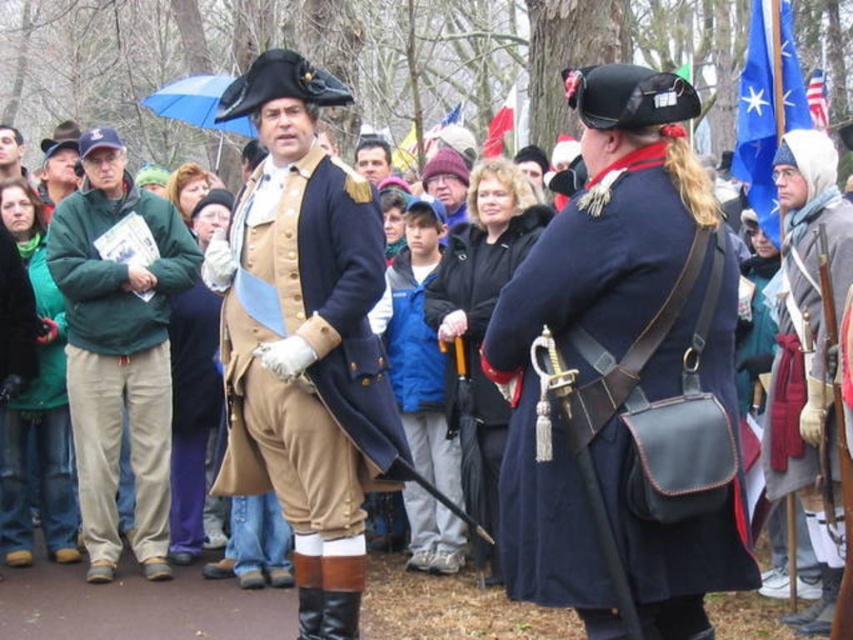
Question: Can you confirm if matte gold uniform at center is positioned above blue fabric jacket at center?

Choices:
 (A) no
 (B) yes

Answer: (B)

Question: Which object appears closest to the camera in this image?

Choices:
 (A) green fleece jacket at left
 (B) blue fabric jacket at center
 (C) navy blue leather coat at center
 (D) american flag at upper right

Answer: (C)

Question: Where is matte gold uniform at center located in relation to blue fabric flag at upper right in the image?

Choices:
 (A) below
 (B) above

Answer: (A)

Question: Which object is the closest to the blue fabric jacket at center?

Choices:
 (A) navy blue leather coat at center
 (B) american flag at upper right

Answer: (A)

Question: Which point appears farthest from the camera in this image?

Choices:
 (A) (454, 428)
 (B) (270, 336)
 (C) (508, 358)

Answer: (A)

Question: Does green fleece jacket at left appear on the right side of blue fabric jacket at center?

Choices:
 (A) yes
 (B) no

Answer: (B)